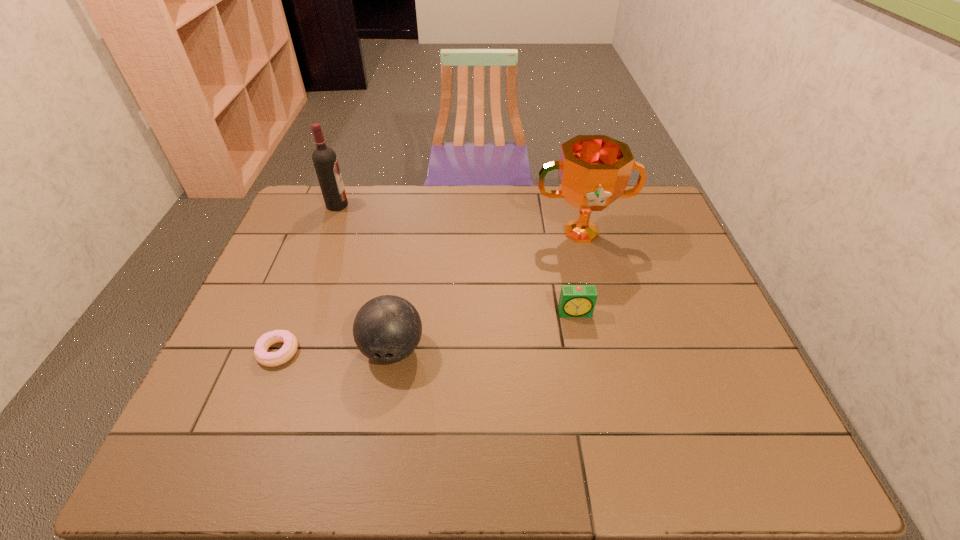
You are a GUI agent. You are given a task and a screenshot of the screen. Output one action in this format:
    pyautogui.click(x=<x>, y=<y>)
    Task: Click on the empty space that is in between the wine bottle and the doughnut
    
    Given the screenshot: What is the action you would take?
    pyautogui.click(x=307, y=279)

The width and height of the screenshot is (960, 540). I want to click on free area in between the doughnut and the fourth nearest object, so click(430, 292).

I want to click on vacant area that lies between the fourth nearest object and the wine bottle, so click(x=459, y=219).

You are a GUI agent. You are given a task and a screenshot of the screen. Output one action in this format:
    pyautogui.click(x=<x>, y=<y>)
    Task: Click on the free space between the doughnut and the second shortest object
    
    Given the screenshot: What is the action you would take?
    pyautogui.click(x=427, y=332)

Where is `object that stands as the closest to the award`? object that stands as the closest to the award is located at coordinates coord(575,300).

Select which object appears as the closest to the second shortest object. Please provide its 2D coordinates. Your answer should be formatted as a tuple, i.e. [(x, y)], where the tuple contains the x and y coordinates of a point satisfying the conditions above.

[(593, 170)]

Locate an element on the screen. The width and height of the screenshot is (960, 540). free space that satisfies the following two spatial constraints: 1. on the label of the wine bottle; 2. on the front side of the shortest object is located at coordinates (280, 352).